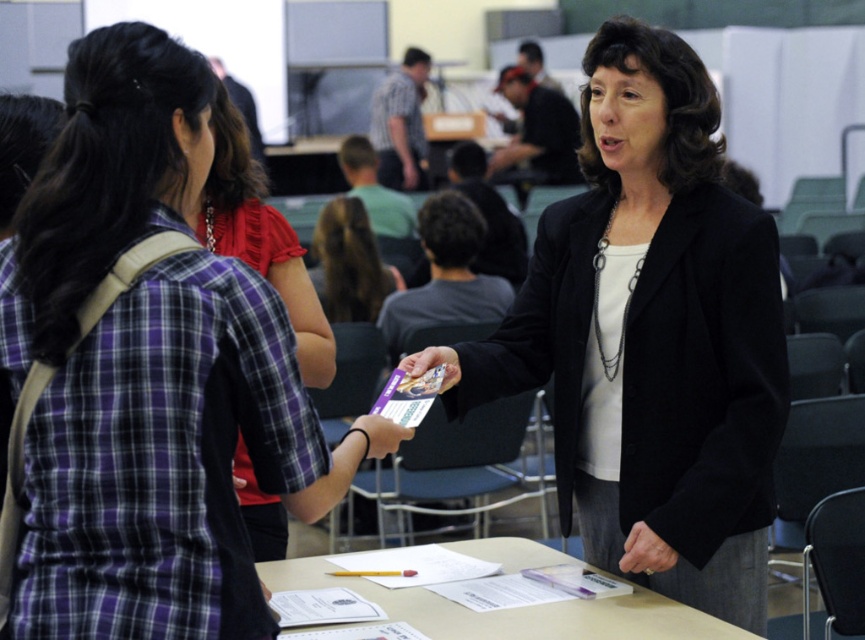
Between smooth beige table at center and brown hair at center, which one has less height?

Standing shorter between the two is smooth beige table at center.

Is point (612, 634) closer to viewer compared to point (331, 307)?

Yes.

At what (x,y) coordinates should I click in order to perform the action: click on smooth beige table at center. Please return your answer as a coordinate pair (x, y). Looking at the image, I should click on (511, 611).

Can you confirm if smooth beige table at center is positioned to the right of plaid fabric shirt at center?

Indeed, smooth beige table at center is positioned on the right side of plaid fabric shirt at center.

Between smooth beige table at center and plaid fabric shirt at center, which one is positioned lower?

smooth beige table at center is below.

Is point (386, 605) behind point (289, 228)?

No, it is not.

What are the coordinates of `smooth beige table at center` in the screenshot? It's located at (511, 611).

Can you confirm if matte black blazer at center is positioned to the right of brown hair at center?

Yes, matte black blazer at center is to the right of brown hair at center.

Can you confirm if matte black blazer at center is wider than brown hair at center?

Yes.

The image size is (865, 640). Describe the element at coordinates (145, 372) in the screenshot. I see `matte black blazer at center` at that location.

Locate an element on the screen. matte black blazer at center is located at coordinates (145, 372).